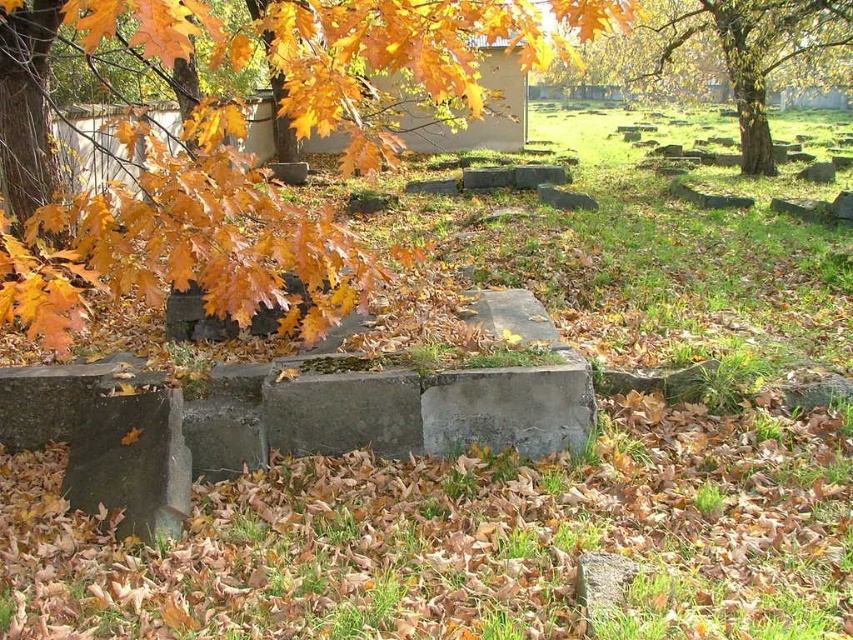
Question: Which of the following is the closest to the observer?

Choices:
 (A) (187, 120)
 (B) (769, 145)

Answer: (A)

Question: Can you confirm if golden leaves at upper left is bigger than golden oak tree at upper right?

Choices:
 (A) yes
 (B) no

Answer: (B)

Question: Is golden leaves at upper left closer to camera compared to golden oak tree at upper right?

Choices:
 (A) yes
 (B) no

Answer: (A)

Question: Can you confirm if golden leaves at upper left is wider than golden oak tree at upper right?

Choices:
 (A) no
 (B) yes

Answer: (A)

Question: Which point is farther to the camera?

Choices:
 (A) golden leaves at upper left
 (B) golden oak tree at upper right

Answer: (B)